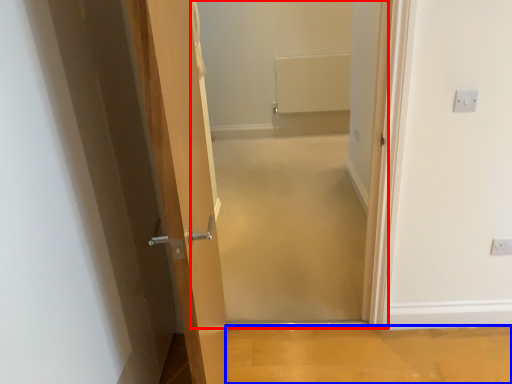
Question: Among these objects, which one is nearest to the camera, corridor (highlighted by a red box) or plain (highlighted by a blue box)?

Choices:
 (A) corridor
 (B) plain

Answer: (A)